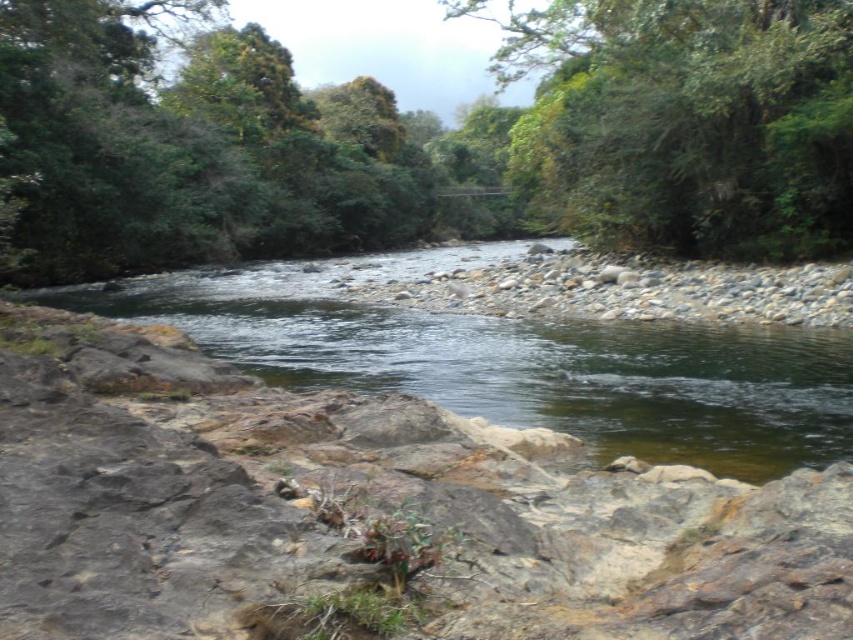
Question: Which point is farther to the camera?

Choices:
 (A) (722, 451)
 (B) (663, 116)

Answer: (B)

Question: Can you confirm if rocky at lower left is wider than clear water at center?

Choices:
 (A) yes
 (B) no

Answer: (B)

Question: Which of the following is the closest to the observer?

Choices:
 (A) green leafy tree at upper center
 (B) rocky at lower left

Answer: (B)

Question: Is clear water at center behind green leafy tree at upper center?

Choices:
 (A) no
 (B) yes

Answer: (A)

Question: Which object is positioned farthest from the green leafy tree at upper center?

Choices:
 (A) rocky at lower left
 (B) clear water at center

Answer: (A)

Question: Can you confirm if clear water at center is positioned below green leafy tree at upper center?

Choices:
 (A) yes
 (B) no

Answer: (A)